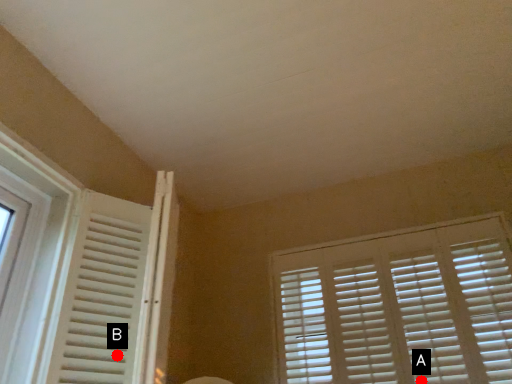
Question: Two points are circled on the image, labeled by A and B beside each circle. Which point is closer to the camera?

Choices:
 (A) A is closer
 (B) B is closer

Answer: (B)